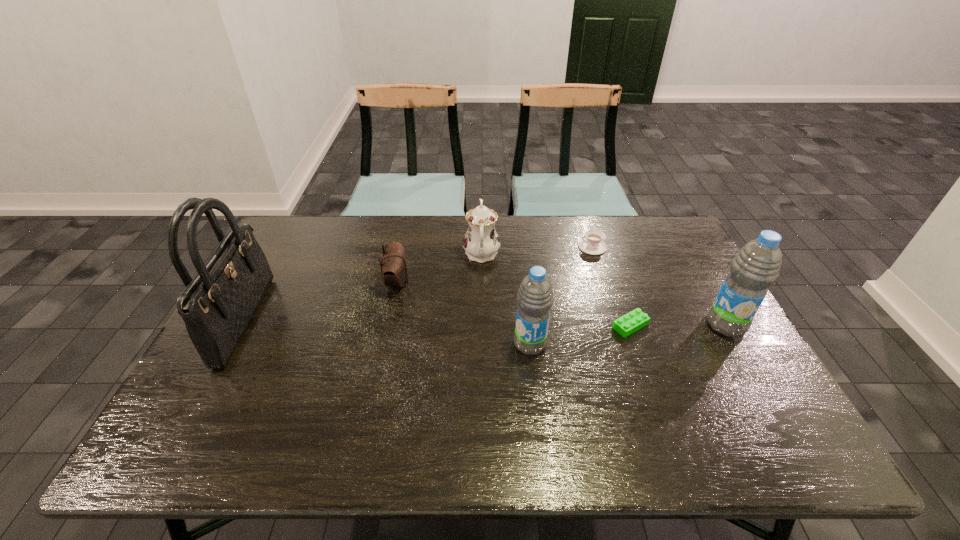
The height and width of the screenshot is (540, 960). In order to click on free space between the rightmost object and the shortest object in this screenshot , I will do `click(678, 325)`.

This screenshot has height=540, width=960. In order to click on free space that is in between the chinaware and the handbag in this screenshot , I will do `click(364, 287)`.

Find the location of `vacant region between the shortest object and the chinaware`. vacant region between the shortest object and the chinaware is located at coordinates (556, 290).

Locate an element on the screen. empty space between the shortest object and the teacup is located at coordinates (612, 286).

Where is `empty space that is in between the pouch and the teacup`? Image resolution: width=960 pixels, height=540 pixels. empty space that is in between the pouch and the teacup is located at coordinates (494, 265).

You are a GUI agent. You are given a task and a screenshot of the screen. Output one action in this format:
    pyautogui.click(x=<x>, y=<y>)
    Task: Click on the free space between the pouch and the teacup
    
    Given the screenshot: What is the action you would take?
    pyautogui.click(x=494, y=265)

Identify the location of empty space that is in between the handbag and the rightmost object. The height and width of the screenshot is (540, 960). (486, 322).

This screenshot has width=960, height=540. What are the coordinates of `free space between the shortest object and the pouch` in the screenshot? It's located at (514, 304).

At what (x,y) coordinates should I click in order to perform the action: click on object that is the third closest one to the third shortest object. Please return your answer as a coordinate pair (x, y). This screenshot has height=540, width=960. Looking at the image, I should click on (535, 297).

Identify which object is the fifth closest to the Lego. Please provide its 2D coordinates. Your answer should be formatted as a tuple, i.e. [(x, y)], where the tuple contains the x and y coordinates of a point satisfying the conditions above.

[(393, 266)]